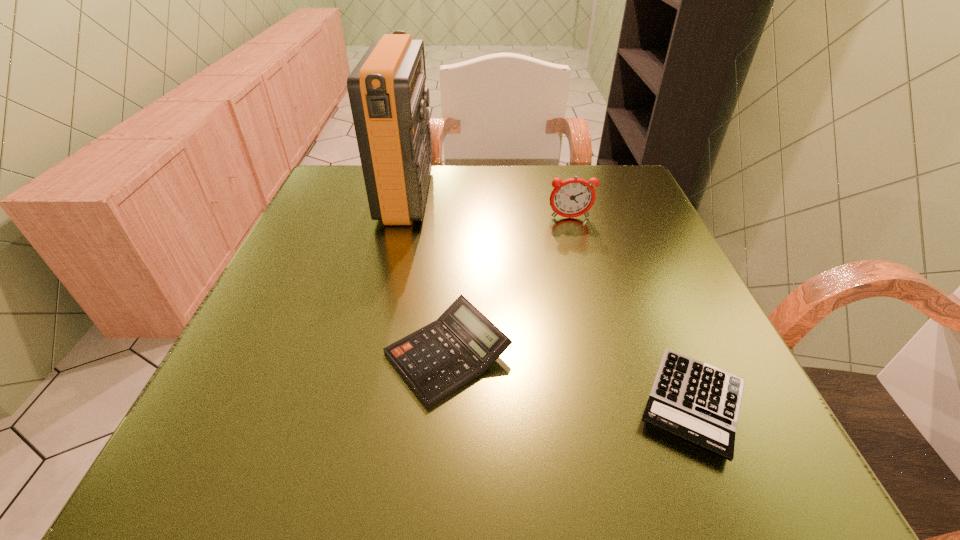
Locate an element on the screen. This screenshot has width=960, height=540. vacant space that satisfies the following two spatial constraints: 1. on the front-facing side of the radio receiver; 2. on the right side of the third tallest object is located at coordinates (369, 354).

Locate an element on the screen. The width and height of the screenshot is (960, 540). free space in the image that satisfies the following two spatial constraints: 1. on the front-facing side of the right calculator; 2. on the left side of the alarm clock is located at coordinates (621, 403).

Identify the location of free spot that satisfies the following two spatial constraints: 1. on the front-facing side of the tallest object; 2. on the back side of the shortest object. The image size is (960, 540). (357, 403).

In order to click on free location that satisfies the following two spatial constraints: 1. on the front-facing side of the right calculator; 2. on the right side of the alarm clock in this screenshot , I will do `click(621, 403)`.